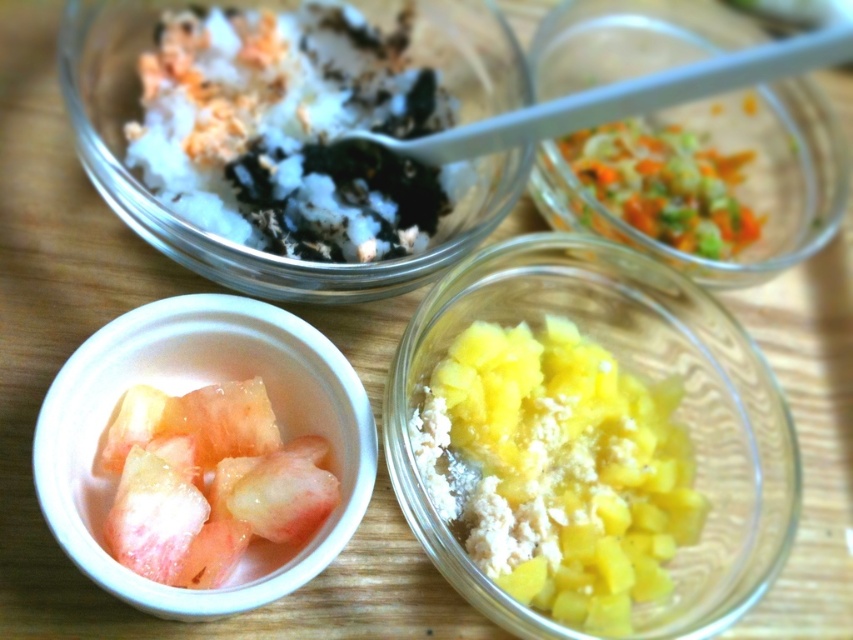
Is white fluffy rice at upper center above translucent plastic bowl at lower left?

Correct, white fluffy rice at upper center is located above translucent plastic bowl at lower left.

Who is taller, white fluffy rice at upper center or translucent plastic bowl at lower left?

With more height is white fluffy rice at upper center.

Between point (383, 248) and point (97, 532), which one is positioned behind?

Point (383, 248)

Locate an element on the screen. The image size is (853, 640). white fluffy rice at upper center is located at coordinates (289, 131).

Locate an element on the screen. The width and height of the screenshot is (853, 640). translucent plastic bowl at lower left is located at coordinates click(181, 392).

Is point (33, 442) closer to camera compared to point (309, 518)?

Yes, point (33, 442) is in front of point (309, 518).

Locate an element on the screen. This screenshot has width=853, height=640. translucent plastic bowl at lower left is located at coordinates (181, 392).

At what (x,y) coordinates should I click in order to perform the action: click on translucent plastic bowl at lower left. Please return your answer as a coordinate pair (x, y). The image size is (853, 640). Looking at the image, I should click on (181, 392).

Which is more to the left, yellow matte pineapple chunks at center or pink translucent fruit at bottom left?

Positioned to the left is pink translucent fruit at bottom left.

You are a GUI agent. You are given a task and a screenshot of the screen. Output one action in this format:
    pyautogui.click(x=<x>, y=<y>)
    Task: Click on the yellow matte pineapple chunks at center
    Image resolution: width=853 pixels, height=640 pixels.
    Given the screenshot: What is the action you would take?
    pyautogui.click(x=635, y=372)